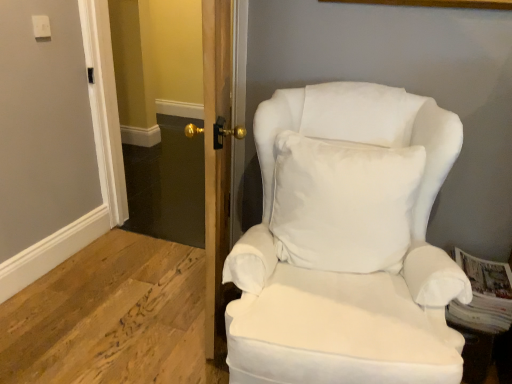
Question: Is wooden door at center touching white soft cushion at center?

Choices:
 (A) no
 (B) yes

Answer: (A)

Question: From the image's perspective, would you say wooden door at center is positioned over white soft cushion at center?

Choices:
 (A) yes
 (B) no

Answer: (A)

Question: Is wooden door at center wider than white soft cushion at center?

Choices:
 (A) no
 (B) yes

Answer: (A)

Question: Considering the relative positions of wooden door at center and white soft cushion at center in the image provided, is wooden door at center to the left of white soft cushion at center from the viewer's perspective?

Choices:
 (A) no
 (B) yes

Answer: (B)

Question: Is wooden door at center smaller than white soft cushion at center?

Choices:
 (A) no
 (B) yes

Answer: (A)

Question: Considering the positions of point (310, 268) and point (216, 107), is point (310, 268) closer or farther from the camera than point (216, 107)?

Choices:
 (A) farther
 (B) closer

Answer: (A)

Question: Relative to wooden door at center, is white fabric chair at right in front or behind?

Choices:
 (A) behind
 (B) front

Answer: (B)

Question: From a real-world perspective, is white fabric chair at right above or below wooden door at center?

Choices:
 (A) below
 (B) above

Answer: (A)

Question: Do you think white fabric chair at right is within wooden door at center, or outside of it?

Choices:
 (A) inside
 (B) outside

Answer: (B)

Question: From the image's perspective, is wooden door at center positioned above or below clear glass door at center?

Choices:
 (A) above
 (B) below

Answer: (B)

Question: Looking at their shapes, would you say wooden door at center is wider or thinner than clear glass door at center?

Choices:
 (A) thin
 (B) wide

Answer: (B)

Question: Is wooden door at center in front of or behind clear glass door at center in the image?

Choices:
 (A) front
 (B) behind

Answer: (A)

Question: Does point (211, 350) appear closer or farther from the camera than point (124, 114)?

Choices:
 (A) farther
 (B) closer

Answer: (B)

Question: Is point (183, 49) positioned closer to the camera than point (389, 246)?

Choices:
 (A) closer
 (B) farther

Answer: (B)

Question: Would you say clear glass door at center is inside or outside white fabric chair at right?

Choices:
 (A) inside
 (B) outside

Answer: (B)